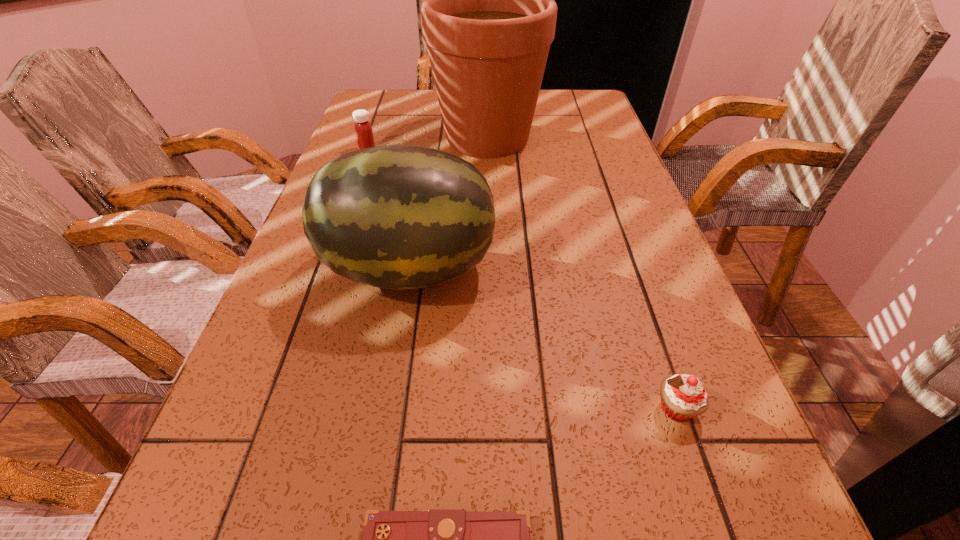
Where is `object at the far edge`? The image size is (960, 540). object at the far edge is located at coordinates (488, 13).

I want to click on watermelon at the left edge, so click(x=400, y=217).

The image size is (960, 540). Identify the location of medicine that is at the left edge. (363, 130).

Where is `object that is at the right edge`? This screenshot has height=540, width=960. object that is at the right edge is located at coordinates (683, 396).

This screenshot has height=540, width=960. Find the location of `vacant space at the far edge of the desktop`. vacant space at the far edge of the desktop is located at coordinates tap(422, 109).

The image size is (960, 540). Identify the location of vacant space at the right edge of the desktop. (595, 130).

Locate an element on the screen. The height and width of the screenshot is (540, 960). blank space at the far left corner of the desktop is located at coordinates (372, 94).

Identify the location of vacant region between the medicine and the tallest object. (427, 144).

This screenshot has height=540, width=960. I want to click on free space that is in between the medicine and the rightmost object, so (x=521, y=279).

What are the coordinates of `empty location between the second tallest object and the cupcake` in the screenshot? It's located at (542, 339).